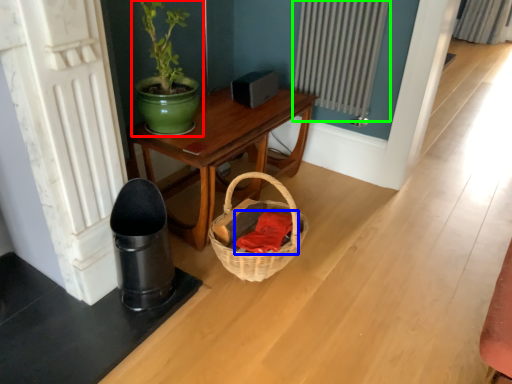
Question: Estimate the real-world distances between objects in this image. Which object is farther from houseplant (highlighted by a red box), clothing (highlighted by a blue box) or radiator (highlighted by a green box)?

Choices:
 (A) clothing
 (B) radiator

Answer: (B)